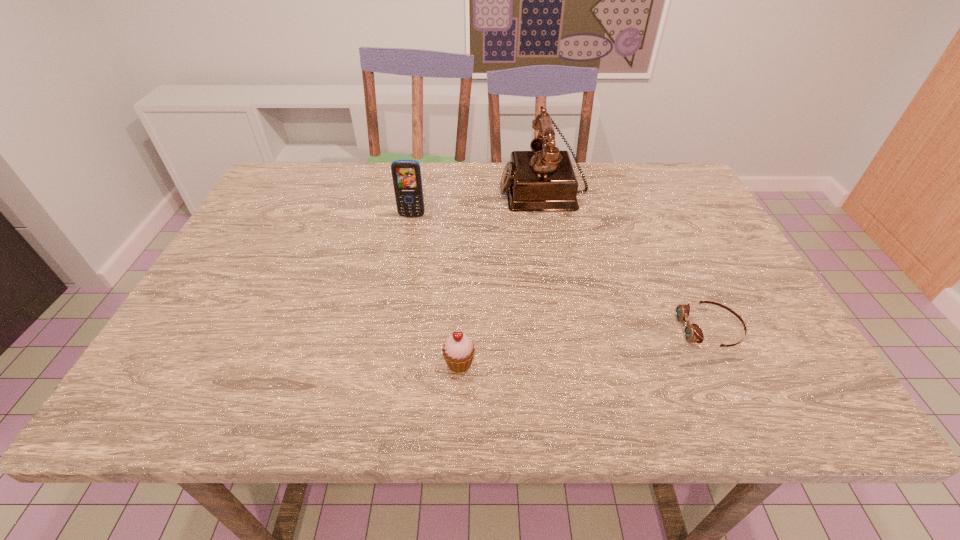
Image resolution: width=960 pixels, height=540 pixels. Identify the location of vacant space that's between the cellular telephone and the third object from left to right. (477, 202).

The width and height of the screenshot is (960, 540). I want to click on vacant space in between the shortest object and the cellular telephone, so click(x=561, y=273).

Where is `unoccupied area between the leftmost object and the second object from right to left`? This screenshot has height=540, width=960. unoccupied area between the leftmost object and the second object from right to left is located at coordinates 477,202.

Identify the location of free space that is in between the cellular telephone and the telephone. The height and width of the screenshot is (540, 960). coord(477,202).

I want to click on unoccupied area between the third object from left to right and the shortest object, so pyautogui.click(x=627, y=259).

The image size is (960, 540). I want to click on object that ranks as the closest to the rightmost object, so click(x=543, y=179).

Select which object is the third closest to the shortest object. Please provide its 2D coordinates. Your answer should be formatted as a tuple, i.e. [(x, y)], where the tuple contains the x and y coordinates of a point satisfying the conditions above.

[(406, 174)]

At what (x,y) coordinates should I click in order to perform the action: click on vacant space that satisfies the following two spatial constraints: 1. on the screen of the second shortest object; 2. on the right side of the cellular telephone. Please return your answer as a coordinate pair (x, y). The width and height of the screenshot is (960, 540). Looking at the image, I should click on (384, 363).

Where is `vacant space that satisfies the following two spatial constraints: 1. on the screen of the third tallest object; 2. on the right side of the second tallest object`? This screenshot has width=960, height=540. vacant space that satisfies the following two spatial constraints: 1. on the screen of the third tallest object; 2. on the right side of the second tallest object is located at coordinates (384, 363).